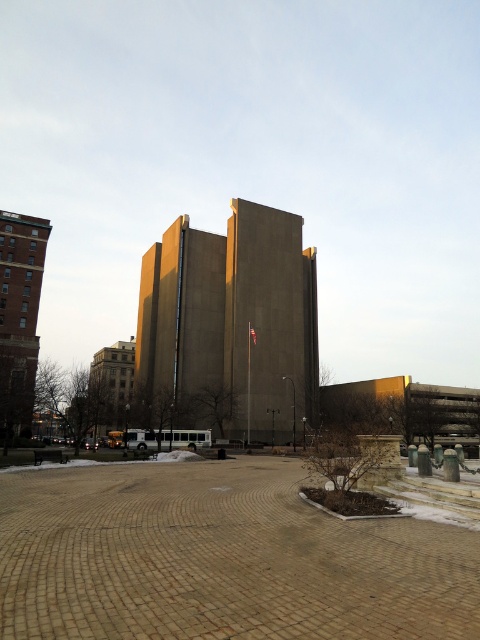
You are standing on the brown brick plaza at center and want to walk to the brick tower at left. Which direction should you head?

You should head upwards because the brown brick plaza at center is below the brick tower at left.

You are standing at the edge of the brown brick plaza at center and looking towards the concrete building at center. Which object is taller?

The concrete building at center is taller than the brown brick plaza at center.